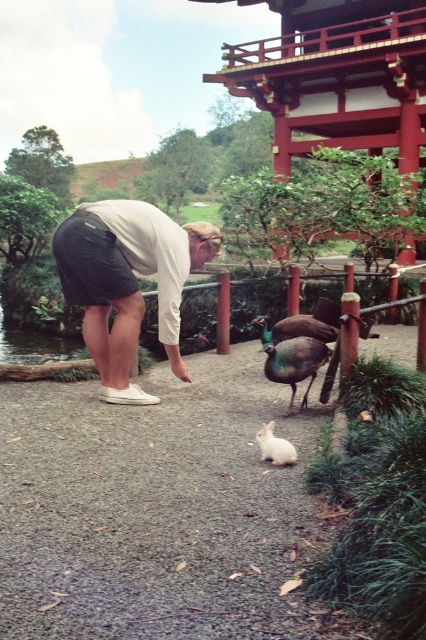
You are a photographer trying to capture a closeup shot of the white cotton shirt at center and the white fluffy rabbit at lower center in the scene. Your camera has a maximum focus range of 1.5 meters. Can you fit both subjects within the focus range to get a clear photo?

The white cotton shirt at center and white fluffy rabbit at lower center are 1.43 meters apart from each other, so yes, the photographer can fit both subjects within the focus range of 1.5 meters for a clear photo.

You are a park ranger who needs to place a 3 feet wide feeding tray between the green iridescent feathers at center and the white fluffy rabbit at lower center. Can the feeding tray fit between them without overlapping either object?

The distance between the green iridescent feathers at center and the white fluffy rabbit at lower center is 3.39 feet. Since the feeding tray is 3 feet wide, it can fit between them as the space available is slightly larger than the tray.

You are a photographer trying to capture a clear photo of the white cotton shirt at center and the white fluffy rabbit at lower center. Since both are white, you need to adjust your camera angle to distinguish them. Which object should you move your camera slightly to the left to focus on?

The white cotton shirt at center is positioned on the left side of white fluffy rabbit at lower center. To focus on the white cotton shirt at center, move the camera slightly to the left since it is already on the left side of the rabbit.